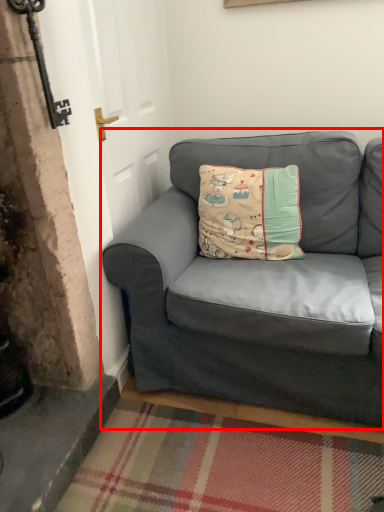
Question: In this image, where is studio couch (annotated by the red box) located relative to pillow?

Choices:
 (A) right
 (B) left

Answer: (A)